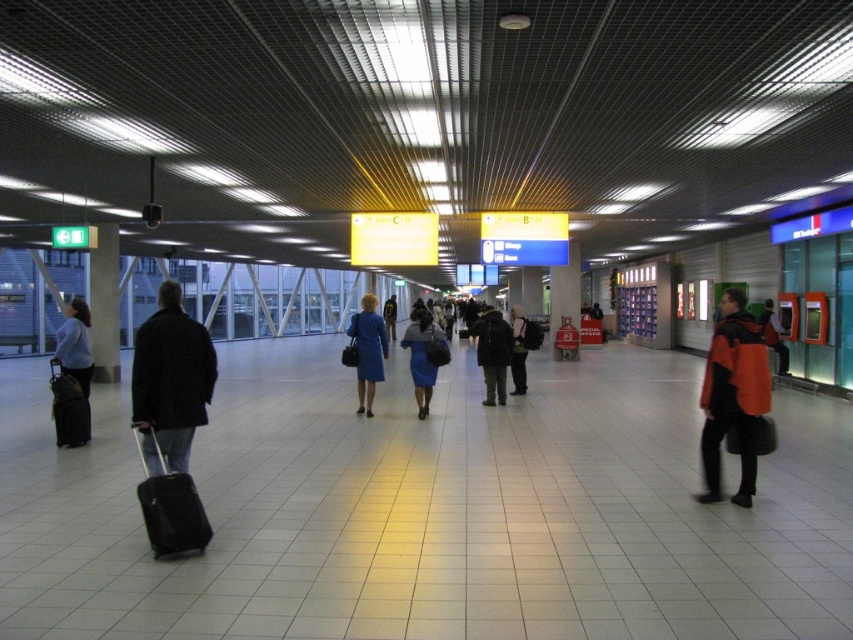
Question: Which point is farther from the camera taking this photo?

Choices:
 (A) (486, 387)
 (B) (746, 500)
 (C) (115, 291)
 (D) (148, 476)

Answer: (C)

Question: Does dark gray jacket at center appear under matte black suitcase at left?

Choices:
 (A) no
 (B) yes

Answer: (B)

Question: Which point is closer to the camera taking this photo?

Choices:
 (A) (743, 364)
 (B) (520, 333)
 (C) (549, 268)
 (D) (170, 419)

Answer: (D)

Question: Is orange fabric backpack at right above black matte suitcase at left?

Choices:
 (A) yes
 (B) no

Answer: (A)

Question: Can you confirm if blue fabric skirt at center is thinner than metallic red pillar at center?

Choices:
 (A) yes
 (B) no

Answer: (B)

Question: Which point is closer to the camera taking this photo?

Choices:
 (A) (746, 346)
 (B) (782, 340)

Answer: (A)